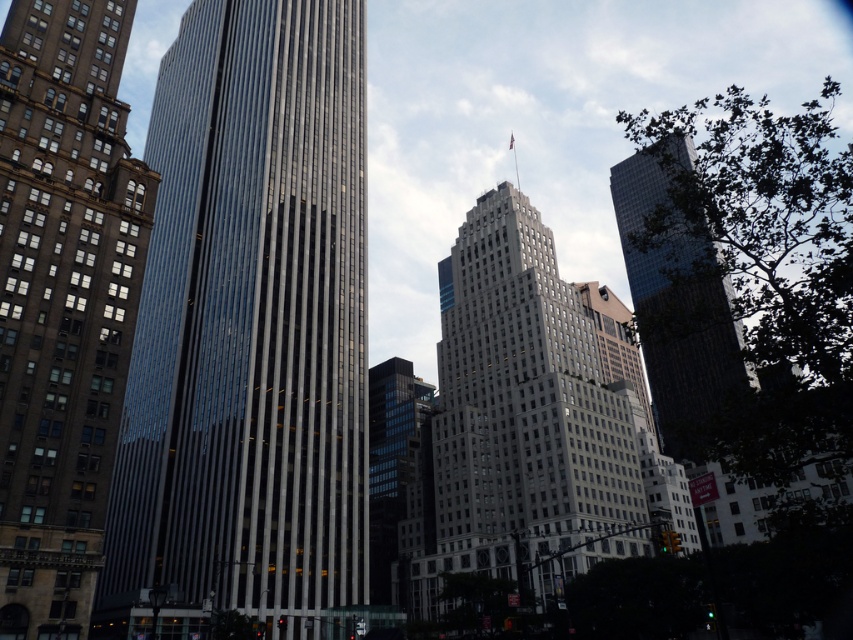
You are a delivery drone flying over the city and need to navigate between the reflective glass skyscraper at center and the brown stone building at left. Which building should you fly past first to stay on course?

You should fly past the brown stone building at left first because the reflective glass skyscraper at center is to the right of it, so following the right side keeps you on course.

You are standing at the point marked as point (62, 300) in the image. Which building are you standing on?

You are standing on the brown stone building at left because the point (62, 300) is located on it.

You are a city planner reviewing this urban layout. You need to determine the spatial relationship between the brown stone building at left and the glassy reflective skyscraper at upper right. Which one is positioned higher in the image?

The brown stone building at left is located above the glassy reflective skyscraper at upper right in the image.